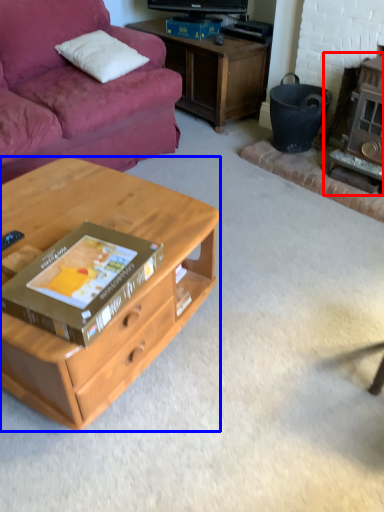
Question: Among these objects, which one is nearest to the camera, fireplace (highlighted by a red box) or desk (highlighted by a blue box)?

Choices:
 (A) fireplace
 (B) desk

Answer: (B)